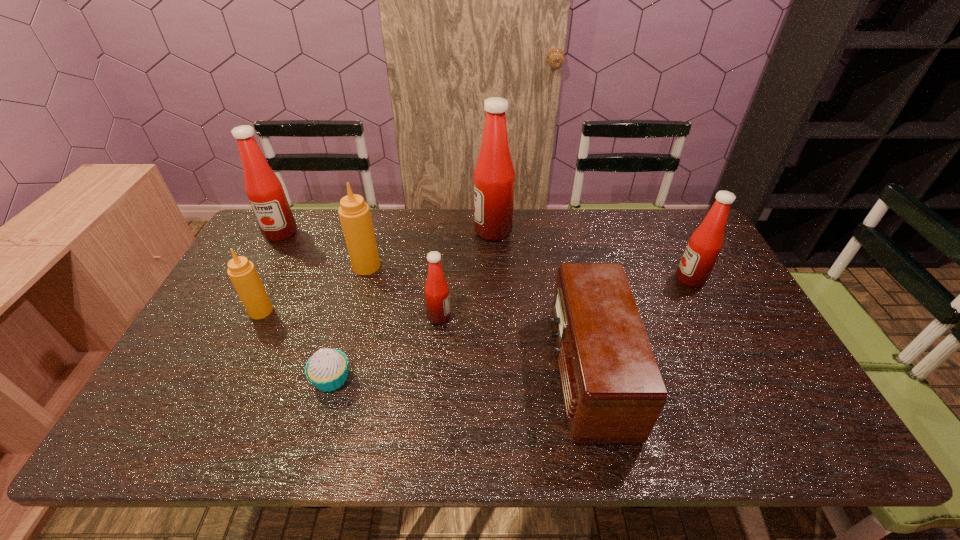
At what (x,y) coordinates should I click in order to perform the action: click on object that is positioned at the right edge. Please return your answer as a coordinate pair (x, y). Image resolution: width=960 pixels, height=540 pixels. Looking at the image, I should click on (704, 246).

Identify the location of object present at the far left corner. The width and height of the screenshot is (960, 540). (264, 190).

I want to click on vacant space at the far edge, so click(650, 228).

The width and height of the screenshot is (960, 540). Find the location of `vacant space at the near edge`. vacant space at the near edge is located at coordinates (536, 427).

I want to click on vacant space at the left edge, so click(181, 359).

The image size is (960, 540). In the image, there is a desktop. In order to click on vacant area at the right edge in this screenshot , I will do `click(730, 352)`.

At what (x,y) coordinates should I click in order to perform the action: click on vacant space at the far right corner. Please return your answer as a coordinate pair (x, y). The image size is (960, 540). Looking at the image, I should click on (686, 218).

Where is `vacant space that's between the third red condiment from left to right and the rightmost object`? This screenshot has width=960, height=540. vacant space that's between the third red condiment from left to right and the rightmost object is located at coordinates (591, 255).

Find the location of a particular element. Image resolution: width=960 pixels, height=540 pixels. free point between the bigger tan condiment and the third biggest red condiment is located at coordinates (529, 273).

Where is `empty location between the second red condiment from right to left and the farther tan condiment`? empty location between the second red condiment from right to left and the farther tan condiment is located at coordinates (430, 248).